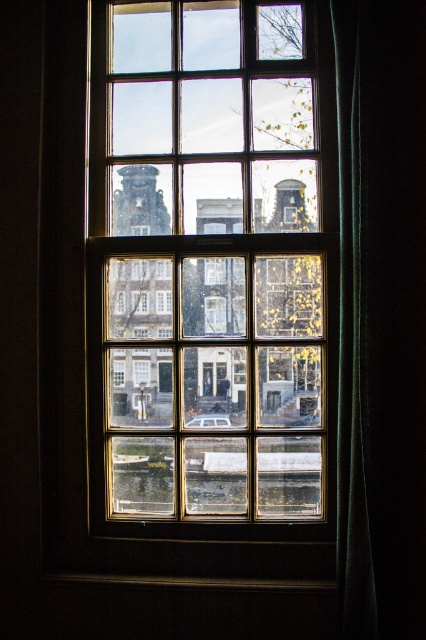
Question: Which of these objects is positioned closest to the wooden frame at center?

Choices:
 (A) green sheer curtain at right
 (B) black wood window sill at lower center

Answer: (A)

Question: Estimate the real-world distances between objects in this image. Which object is farther from the green sheer curtain at right?

Choices:
 (A) wooden frame at center
 (B) black wood window sill at lower center

Answer: (B)

Question: From the image, what is the correct spatial relationship of wooden frame at center in relation to green sheer curtain at right?

Choices:
 (A) below
 (B) above

Answer: (B)

Question: Can you confirm if green sheer curtain at right is wider than black wood window sill at lower center?

Choices:
 (A) no
 (B) yes

Answer: (A)

Question: Is wooden frame at center positioned in front of green sheer curtain at right?

Choices:
 (A) no
 (B) yes

Answer: (A)

Question: Which object is the farthest from the green sheer curtain at right?

Choices:
 (A) wooden frame at center
 (B) black wood window sill at lower center

Answer: (B)